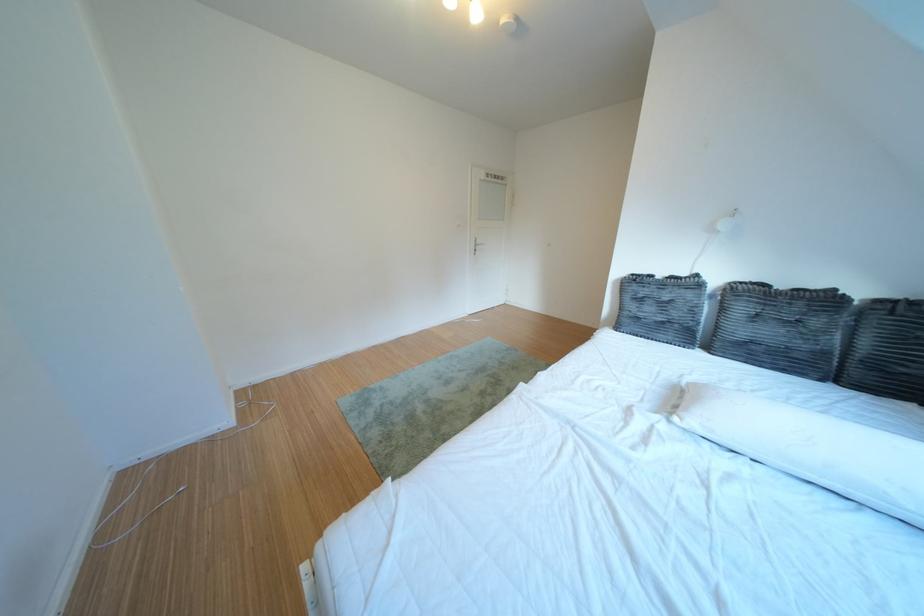
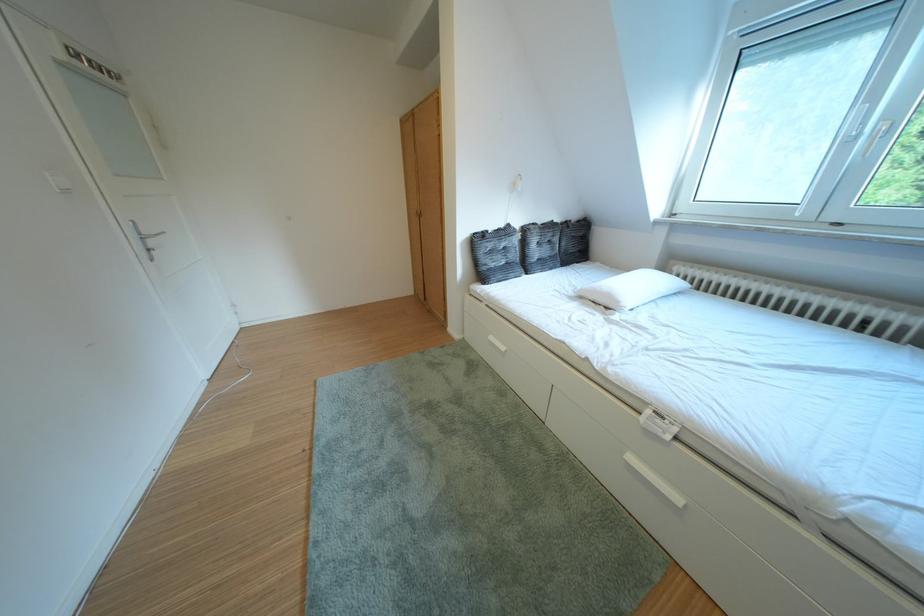
In the second image, find the point that corresponds to (x=665, y=282) in the first image.

(500, 237)